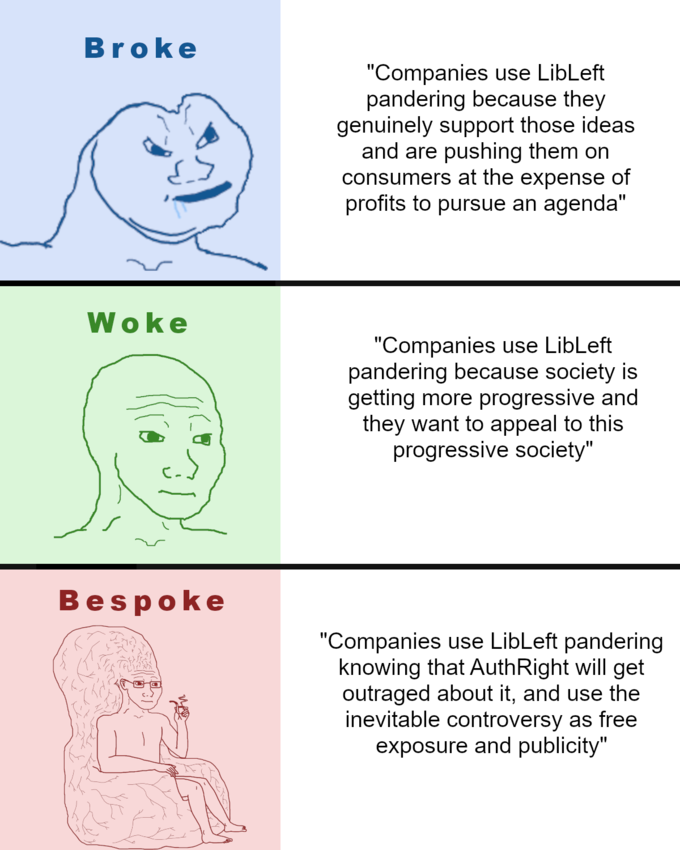
Where is `picture`? picture is located at coordinates (162, 720), (171, 432), (192, 151).